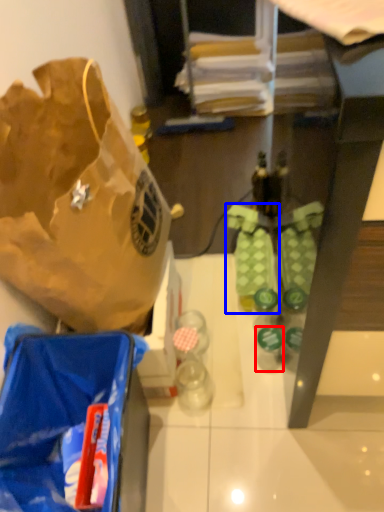
Question: Among these objects, which one is nearest to the camera, bottle (highlighted by a red box) or footwear (highlighted by a blue box)?

Choices:
 (A) bottle
 (B) footwear

Answer: (A)